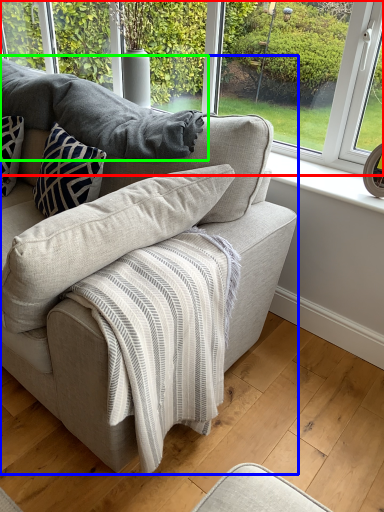
Question: Based on their relative distances, which object is farther from window (highlighted by a red box)? Choose from studio couch (highlighted by a blue box) and gray (highlighted by a green box).

Choices:
 (A) studio couch
 (B) gray

Answer: (A)